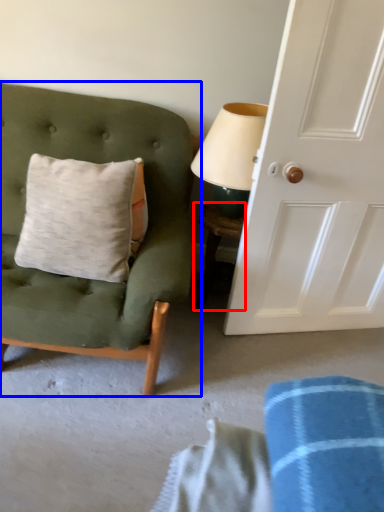
Question: Which point is further to the camera, table (highlighted by a red box) or chair (highlighted by a blue box)?

Choices:
 (A) table
 (B) chair

Answer: (A)